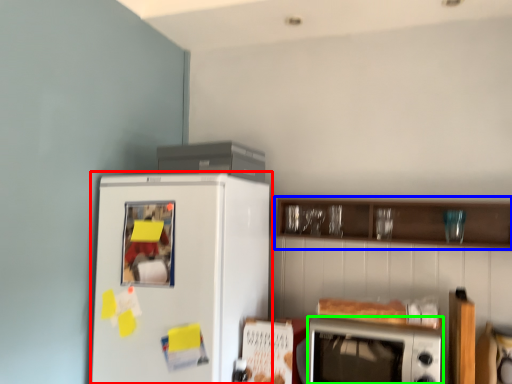
Question: Which is farther away from refrigerator (highlighted by a red box)? cabinetry (highlighted by a blue box) or microwave oven (highlighted by a green box)?

Choices:
 (A) cabinetry
 (B) microwave oven

Answer: (A)